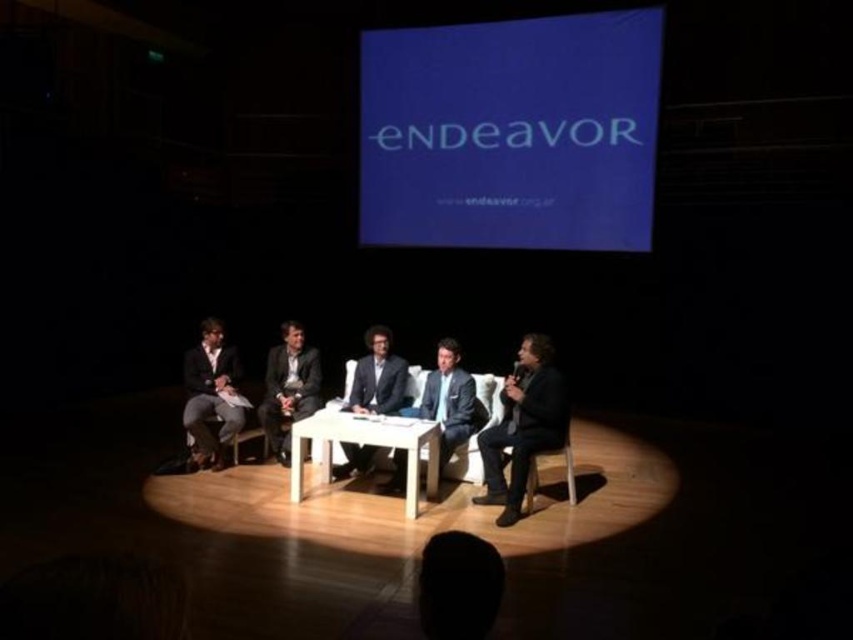
Who is more distant from viewer, (514, 440) or (312, 388)?

Positioned behind is point (312, 388).

Does point (517, 376) lie behind point (276, 440)?

No, (517, 376) is closer to viewer.

I want to click on black leather jacket at center, so [x=523, y=426].

Measure the distance between white wooden table at center and matte black suit at center.

white wooden table at center and matte black suit at center are 20.08 inches apart from each other.

You are a GUI agent. You are given a task and a screenshot of the screen. Output one action in this format:
    pyautogui.click(x=<x>, y=<y>)
    Task: Click on the white wooden table at center
    
    Given the screenshot: What is the action you would take?
    pyautogui.click(x=368, y=444)

Who is higher up, matte black suit at left or light blue suit at center?

matte black suit at left is higher up.

Between matte black suit at left and light blue suit at center, which one appears on the left side from the viewer's perspective?

From the viewer's perspective, matte black suit at left appears more on the left side.

Between point (213, 332) and point (460, 365), which one is positioned behind?

Positioned behind is point (460, 365).

The image size is (853, 640). I want to click on matte black suit at left, so click(x=210, y=400).